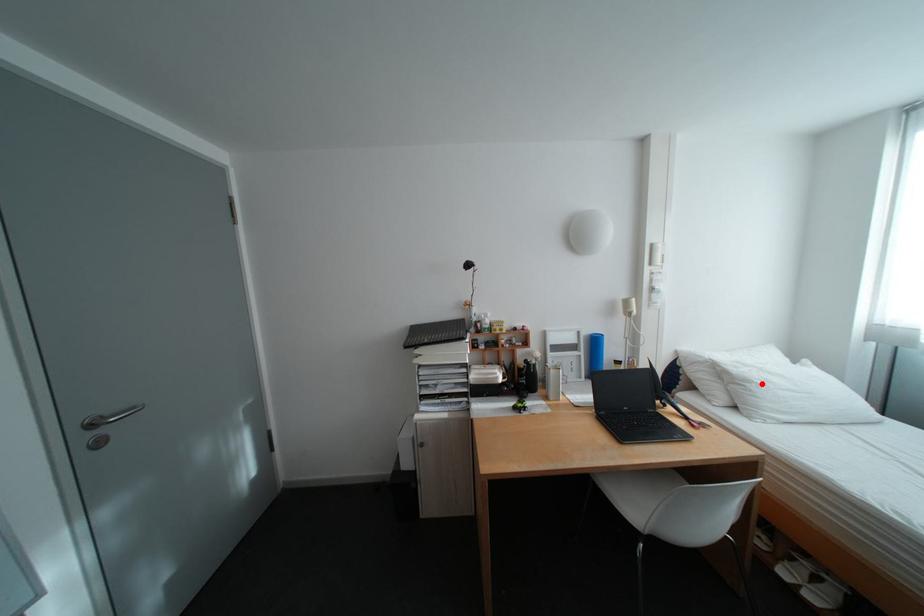
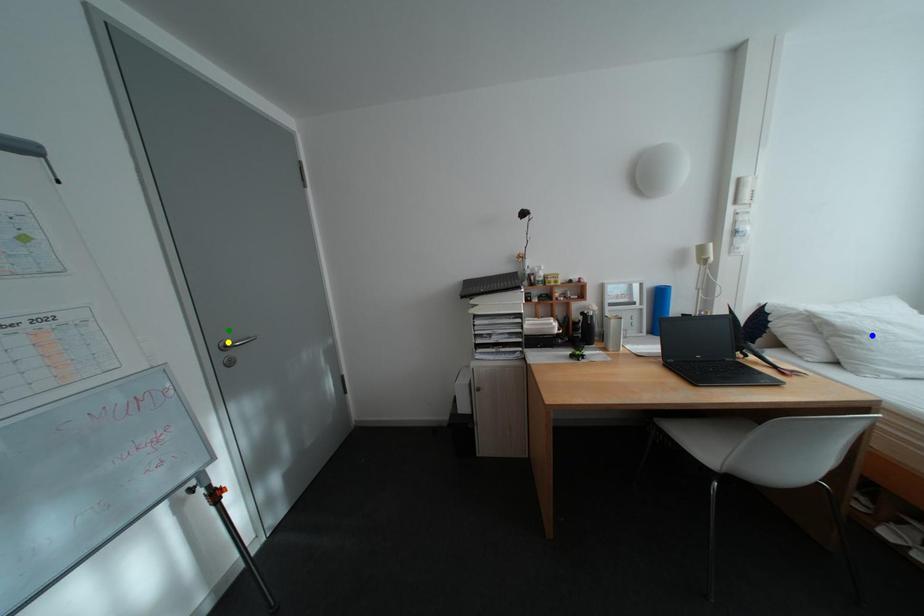
Question: I am providing you with two images of the same scene from different viewpoints. A red point is marked on the first image. You are given multiple points on the second image. In image 2, which mark is for the same physical point as the one in image 1?

Choices:
 (A) yellow point
 (B) blue point
 (C) green point

Answer: (B)